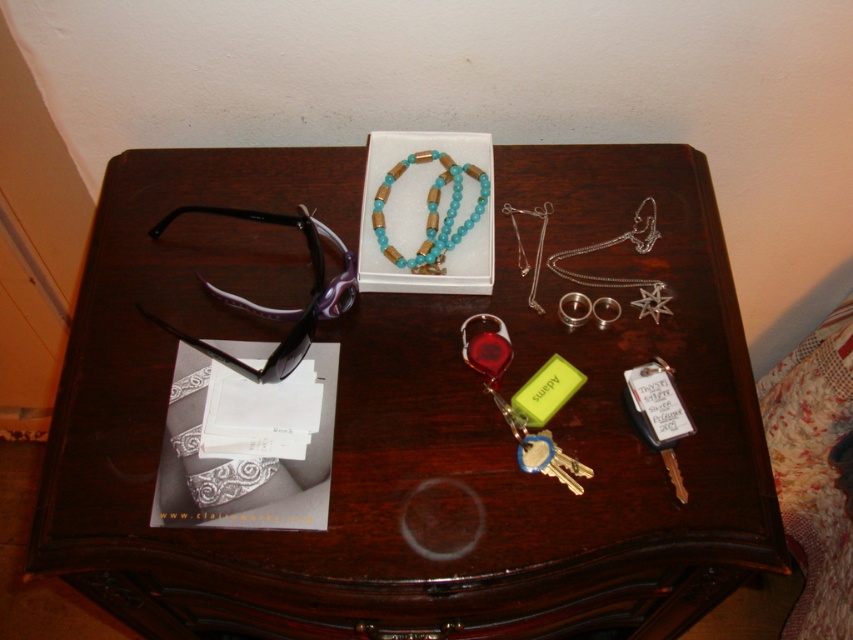
You are standing in front of the table and want to pick up the item closest to you. Which point should you reach for, point A at (169, 214) or point B at (479, 355)?

You should reach for point A at (169, 214) because it is closer to you than point B at (479, 355).

You are standing at the point marked as point (294, 358). You want to pick up the black framed sunglasses with purple lenses on the left side of the table. Can you reach them from your current position?

The distance between point (294, 358) and the black framed sunglasses with purple lenses on the left side of the table is 29.37 inches. Since the average human arm length is about 25 inches, you cannot reach them from your current position.

You are organizing items on the dark wooden nightstand. You need to place a new item between the purple plastic sunglasses at left and the turquoise beads necklace at center. Where should you place it?

You should place the new item between the purple plastic sunglasses at left and the turquoise beads necklace at center, to the right of the purple plastic sunglasses at left since it is positioned on the left side of the turquoise beads necklace at center.